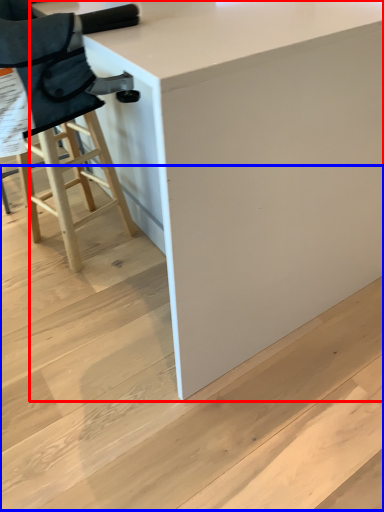
Question: Which object appears farthest to the camera in this image, table (highlighted by a red box) or stair (highlighted by a blue box)?

Choices:
 (A) table
 (B) stair

Answer: (B)